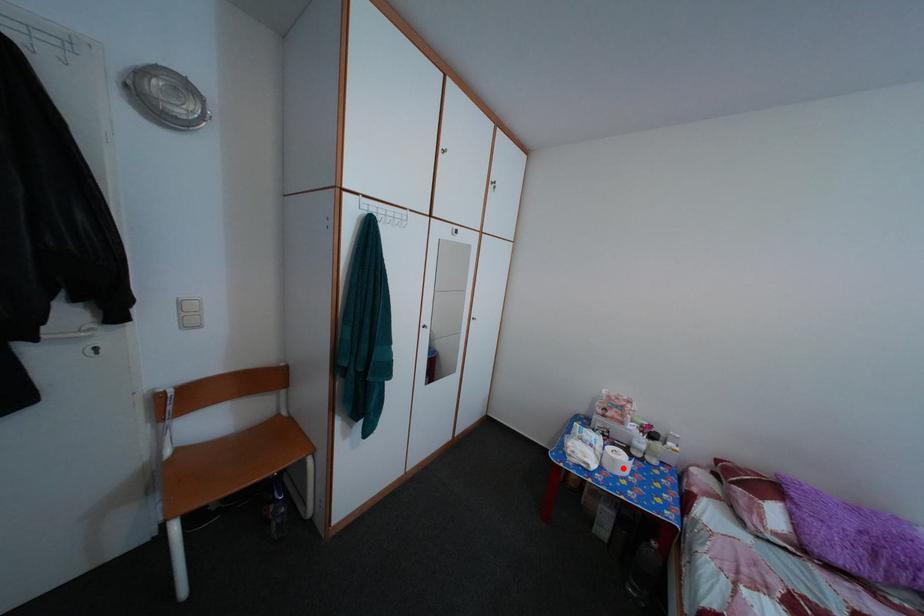
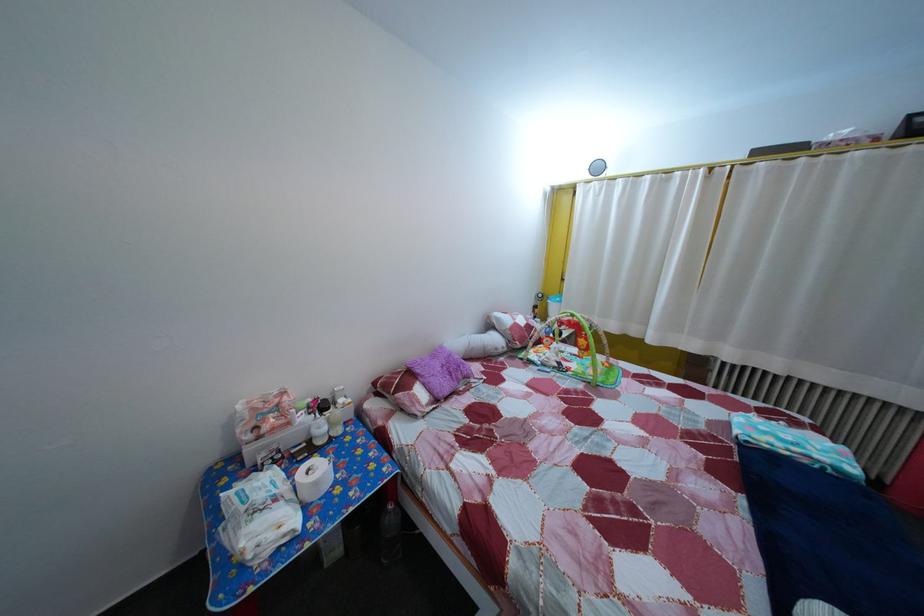
The point at the highlighted location is marked in the first image. Where is the corresponding point in the second image?

(325, 491)